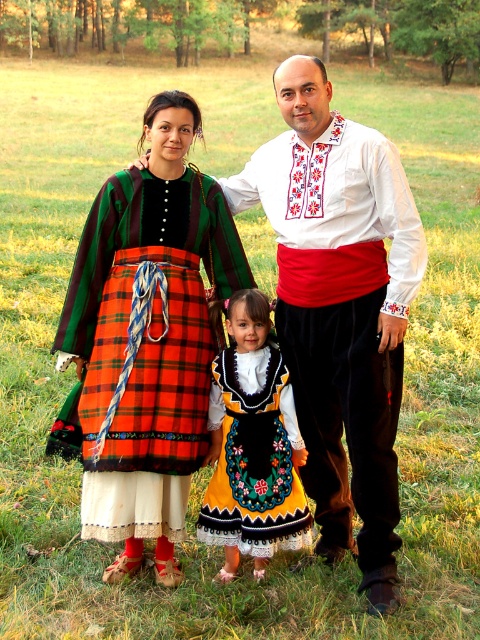
Question: Which point is farther to the camera?

Choices:
 (A) plaid fabric dress at center
 (B) embroidered cotton shirt at center

Answer: (A)

Question: Is matte plaid skirt at center below embroidered cotton dress at center?

Choices:
 (A) no
 (B) yes

Answer: (A)

Question: Which point appears closest to the camera in this image?

Choices:
 (A) (345, 508)
 (B) (377, 305)

Answer: (B)

Question: Does plaid fabric dress at center have a greater width compared to embroidered cotton dress at center?

Choices:
 (A) no
 (B) yes

Answer: (B)

Question: Among these objects, which one is farthest from the camera?

Choices:
 (A) embroidered cotton shirt at center
 (B) matte plaid skirt at center
 (C) embroidered cotton dress at center
 (D) plaid fabric dress at center

Answer: (C)

Question: Considering the relative positions of matte plaid skirt at center and embroidered cotton dress at center in the image provided, where is matte plaid skirt at center located with respect to embroidered cotton dress at center?

Choices:
 (A) right
 (B) left

Answer: (A)